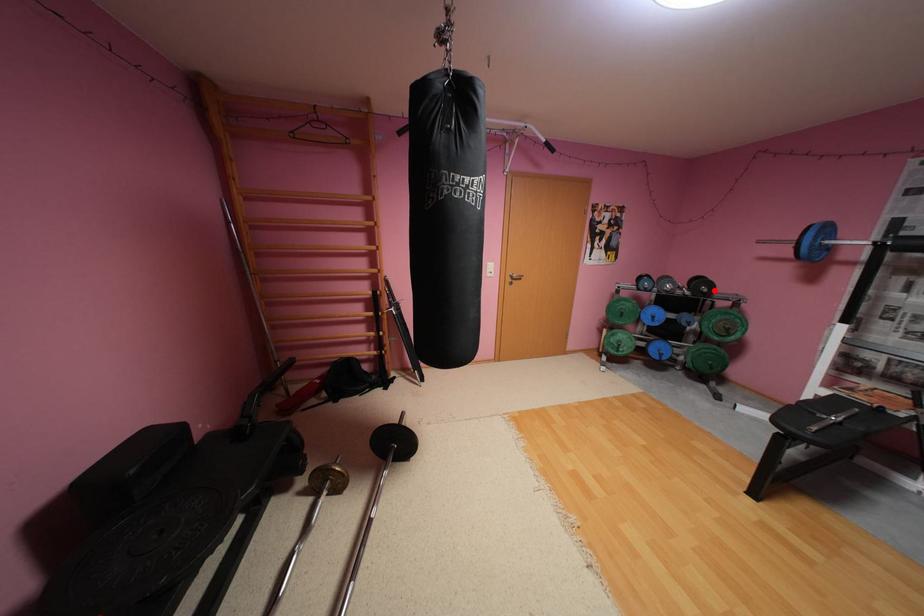
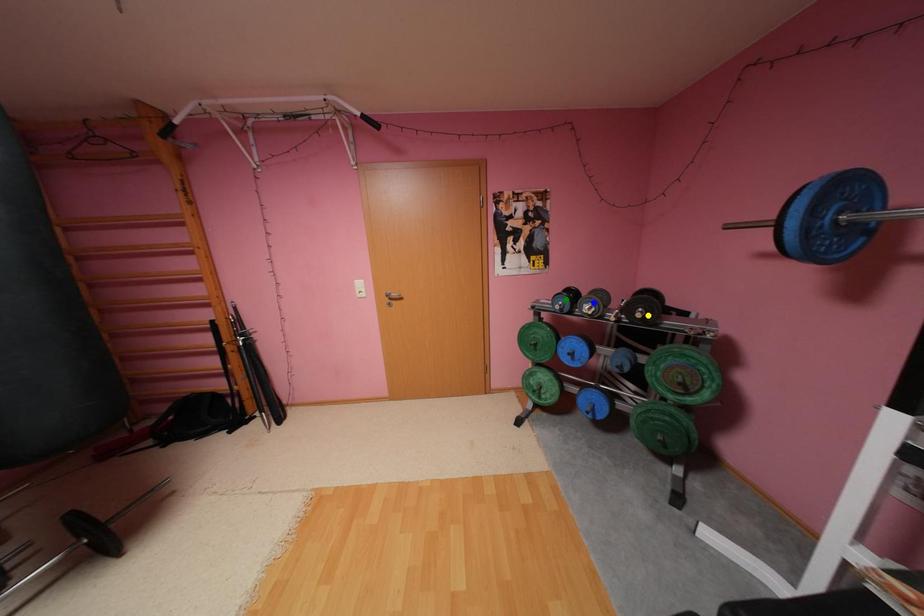
Question: I am providing you with two images of the same scene from different viewpoints. A red point is marked on the first image. You are given multiple points on the second image. Can you choose the point in image 2 that corresponds to the point in image 1?

Choices:
 (A) yellow point
 (B) green point
 (C) blue point

Answer: (A)